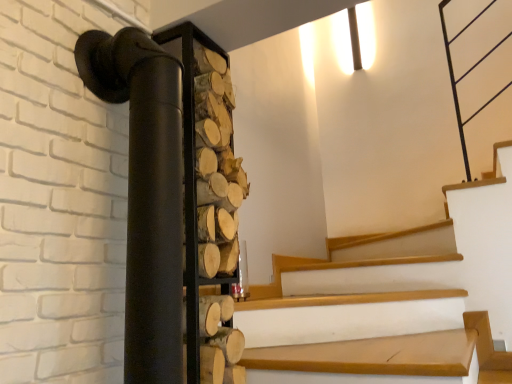
This screenshot has height=384, width=512. What are the coordinates of `wooden logs at center` in the screenshot? It's located at (208, 207).

This screenshot has width=512, height=384. Describe the element at coordinates (208, 207) in the screenshot. I see `wooden logs at center` at that location.

The width and height of the screenshot is (512, 384). I want to click on wooden logs at center, so pos(208,207).